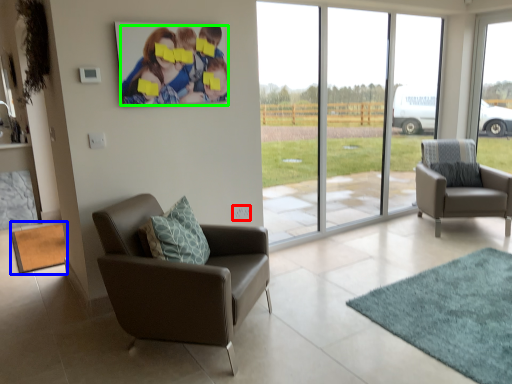
Question: Which is nearer to the power outlet (highlighted by a red box)? mat (highlighted by a blue box) or couple (highlighted by a green box).

Choices:
 (A) mat
 (B) couple

Answer: (B)